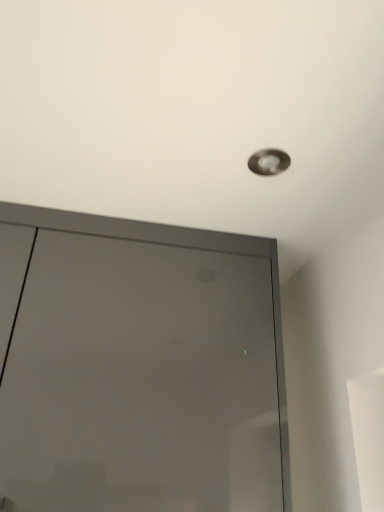
Where is `matte silver droplight at upper center`? This screenshot has width=384, height=512. matte silver droplight at upper center is located at coordinates (269, 162).

Describe the element at coordinates (269, 162) in the screenshot. I see `matte silver droplight at upper center` at that location.

This screenshot has height=512, width=384. What do you see at coordinates (139, 367) in the screenshot? I see `matte gray door at upper center` at bounding box center [139, 367].

This screenshot has width=384, height=512. What are the coordinates of `matte gray door at upper center` in the screenshot? It's located at (139, 367).

In the scene shown: In order to face matte gray door at upper center, should I rotate leftwards or rightwards?

A 10.512 degree turn to the left will do.

Measure the distance between point (228,442) and camera.

A distance of 35.24 inches exists between point (228,442) and camera.

In order to click on matte silver droplight at upper center in this screenshot , I will do `click(269, 162)`.

Between matte gray door at upper center and matte silver droplight at upper center, which one appears on the right side from the viewer's perspective?

From the viewer's perspective, matte silver droplight at upper center appears more on the right side.

Who is more distant, matte gray door at upper center or matte silver droplight at upper center?

matte silver droplight at upper center is further from the camera.

Does point (6, 266) come closer to viewer compared to point (274, 170)?

No, (6, 266) is further to viewer.

From the image's perspective, is matte gray door at upper center below matte silver droplight at upper center?

Yes, from the image's perspective, matte gray door at upper center is below matte silver droplight at upper center.

From a real-world perspective, between matte gray door at upper center and matte silver droplight at upper center, who is vertically higher?

In real-world perspective, matte silver droplight at upper center is above.

Can you confirm if matte gray door at upper center is thinner than matte silver droplight at upper center?

Incorrect, the width of matte gray door at upper center is not less than that of matte silver droplight at upper center.

Who is shorter, matte gray door at upper center or matte silver droplight at upper center?

matte silver droplight at upper center.

Considering the sizes of matte gray door at upper center and matte silver droplight at upper center in the image, is matte gray door at upper center bigger or smaller than matte silver droplight at upper center?

Considering their sizes, matte gray door at upper center takes up more space than matte silver droplight at upper center.

Is matte silver droplight at upper center completely or partially inside matte gray door at upper center?

No, matte silver droplight at upper center is not surrounded by matte gray door at upper center.

Are matte gray door at upper center and matte silver droplight at upper center far apart?

That's not correct — matte gray door at upper center is a little close to matte silver droplight at upper center.

Consider the image. Could you tell me if matte gray door at upper center is facing matte silver droplight at upper center?

Yes, matte gray door at upper center is oriented towards matte silver droplight at upper center.

This screenshot has width=384, height=512. Find the location of `door to the left of matte silver droplight at upper center`. door to the left of matte silver droplight at upper center is located at coordinates (139, 367).

Considering the relative positions of matte silver droplight at upper center and matte gray door at upper center in the image provided, is matte silver droplight at upper center to the right of matte gray door at upper center from the viewer's perspective?

Yes, matte silver droplight at upper center is to the right of matte gray door at upper center.

Is matte silver droplight at upper center further to camera compared to matte gray door at upper center?

That is True.

Considering the positions of points (273, 165) and (65, 261), is point (273, 165) closer to camera compared to point (65, 261)?

Yes.

From the image's perspective, would you say matte silver droplight at upper center is positioned over matte gray door at upper center?

Yes.

From a real-world perspective, is matte silver droplight at upper center on top of matte gray door at upper center?

Yes.

Which object is wider, matte silver droplight at upper center or matte gray door at upper center?

With larger width is matte gray door at upper center.

Who is shorter, matte silver droplight at upper center or matte gray door at upper center?

matte silver droplight at upper center is shorter.

In terms of size, does matte silver droplight at upper center appear bigger or smaller than matte gray door at upper center?

Clearly, matte silver droplight at upper center is smaller in size than matte gray door at upper center.

Is matte silver droplight at upper center located outside matte gray door at upper center?

Yes.

Is matte silver droplight at upper center far from matte gray door at upper center?

No, matte silver droplight at upper center is in close proximity to matte gray door at upper center.

Is matte silver droplight at upper center oriented towards matte gray door at upper center?

No, matte silver droplight at upper center is not turned towards matte gray door at upper center.

How many degrees apart are the facing directions of matte silver droplight at upper center and matte gray door at upper center?

The angular difference between matte silver droplight at upper center and matte gray door at upper center is 89.9 degrees.

Measure the distance from matte silver droplight at upper center to matte gray door at upper center.

They are 19.37 inches apart.

I want to click on door that is below the matte silver droplight at upper center (from the image's perspective), so click(x=139, y=367).

You are a GUI agent. You are given a task and a screenshot of the screen. Output one action in this format:
    pyautogui.click(x=<x>, y=<y>)
    Task: Click on the door on the left side of matte silver droplight at upper center
    
    Given the screenshot: What is the action you would take?
    pyautogui.click(x=139, y=367)

The width and height of the screenshot is (384, 512). Find the location of `door lying in front of the matte silver droplight at upper center`. door lying in front of the matte silver droplight at upper center is located at coordinates (139, 367).